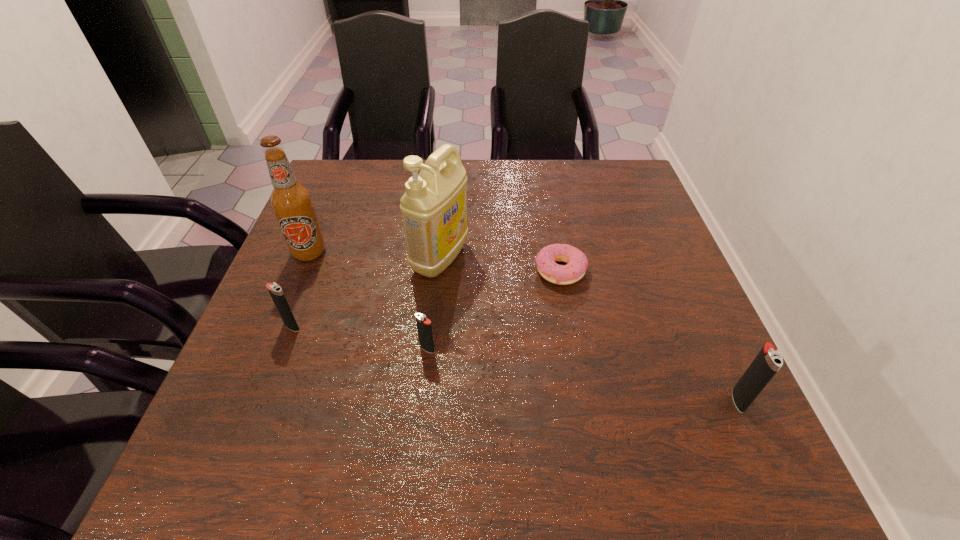
Where is `object at the near right corner`? This screenshot has height=540, width=960. object at the near right corner is located at coordinates (766, 364).

Locate an element on the screen. Image resolution: width=960 pixels, height=540 pixels. vacant space at the far edge of the desktop is located at coordinates (519, 168).

This screenshot has width=960, height=540. In order to click on vacant space at the near edge in this screenshot , I will do coord(582,421).

In the image, there is a desktop. In order to click on vacant space at the left edge in this screenshot , I will do `click(348, 240)`.

In the image, there is a desktop. Where is `vacant space at the right edge`? Image resolution: width=960 pixels, height=540 pixels. vacant space at the right edge is located at coordinates (635, 346).

This screenshot has width=960, height=540. I want to click on free region at the far left corner of the desktop, so click(329, 198).

I want to click on vacant space at the near left corner of the desktop, so click(277, 399).

This screenshot has width=960, height=540. I want to click on vacant space at the far right corner of the desktop, so click(609, 174).

The width and height of the screenshot is (960, 540). I want to click on vacant space in between the beer bottle and the nearest object, so click(524, 326).

What are the coordinates of `free space between the farthest igniter and the second igniter from left to right` in the screenshot? It's located at (360, 338).